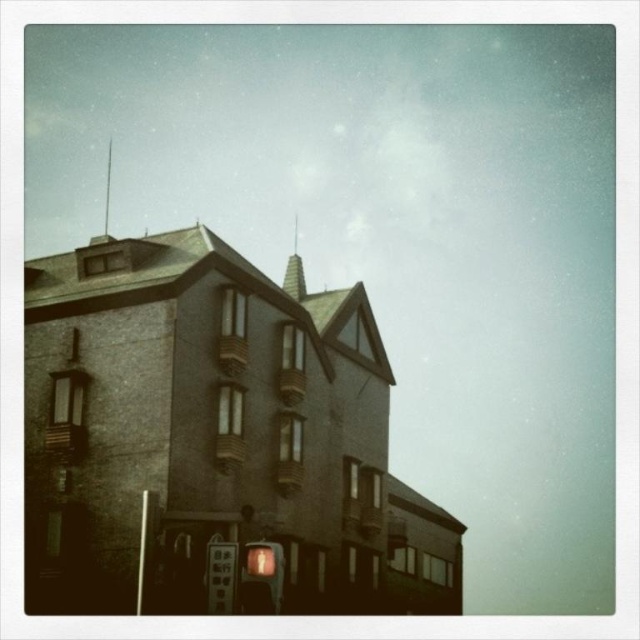
You are a pedestrian standing at the intersection and see the matte orange traffic light at center and the metallic gray sign at lower center. Which object is located to the right of the other?

The matte orange traffic light at center is positioned on the right side of metallic gray sign at lower center.

You are standing in front of the building and notice two points marked on its facade. The first point is at coordinate point(259, 556) and the second is at point(212, 586). Which point is closer to you?

Point(259, 556) is closer to the viewer than point(212, 586).